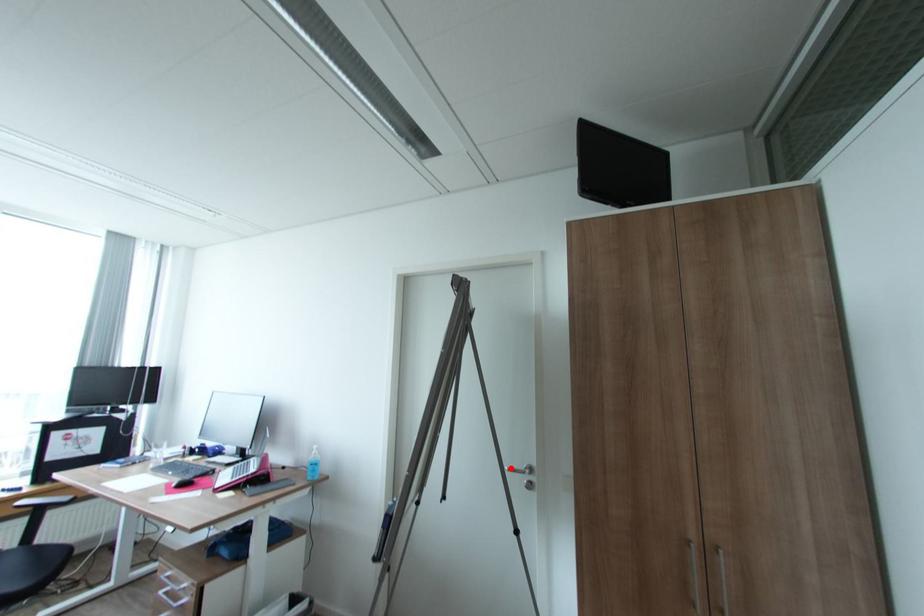
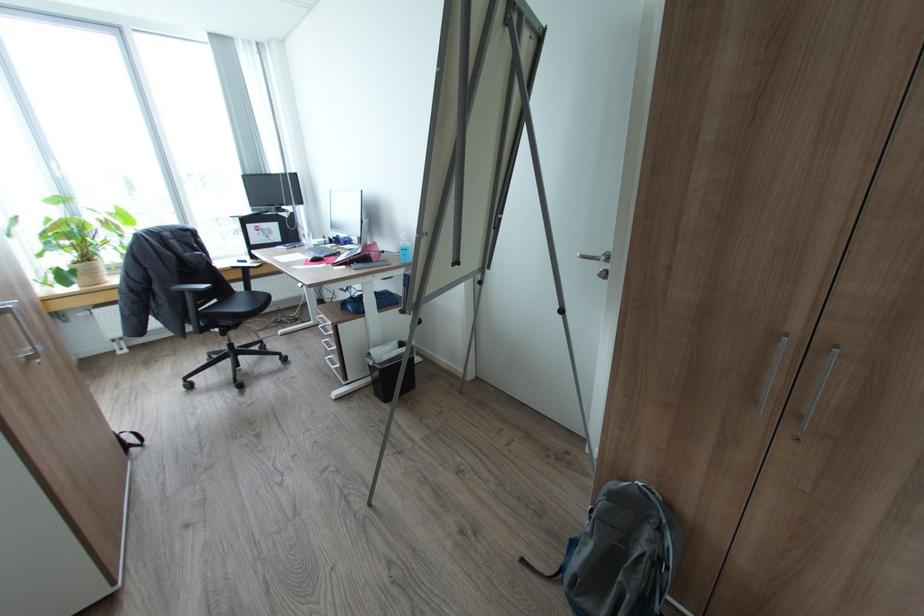
Locate, in the second image, the point that corresponds to the highlighted location in the first image.

(582, 254)